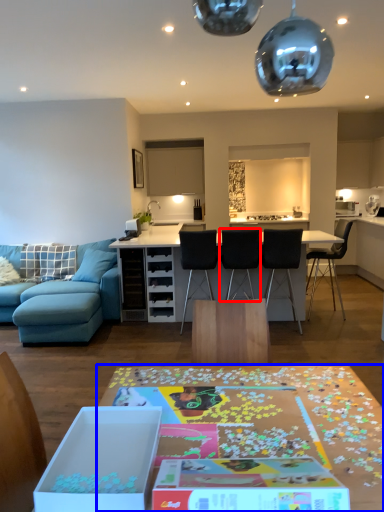
Question: Which object appears closest to the camera in this image, chair (highlighted by a red box) or table (highlighted by a blue box)?

Choices:
 (A) chair
 (B) table

Answer: (B)